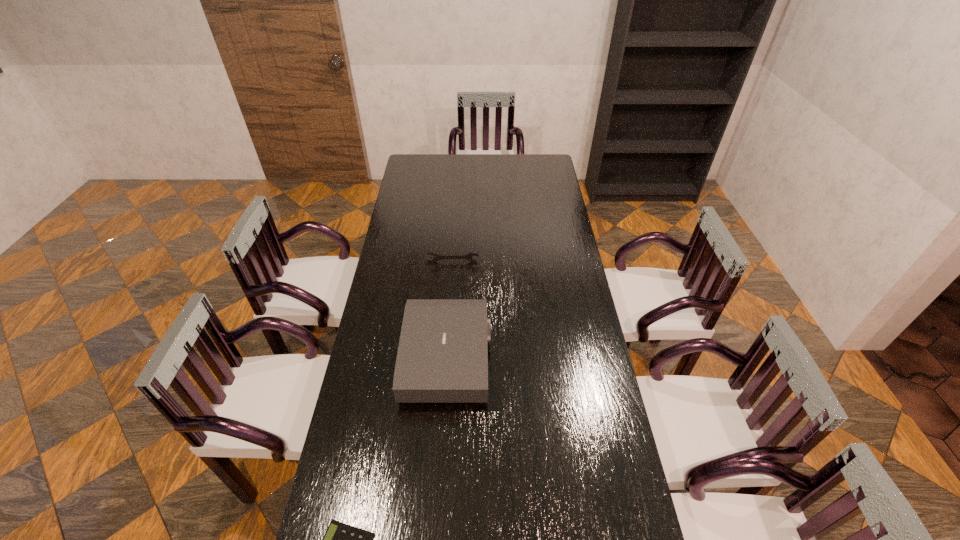
In the image, there is a desktop. Where is `vacant space at the far left corner`? This screenshot has width=960, height=540. vacant space at the far left corner is located at coordinates (413, 158).

Where is `object that is the closest to the second shortest object`? object that is the closest to the second shortest object is located at coordinates (442, 357).

Image resolution: width=960 pixels, height=540 pixels. What are the coordinates of `the second closest object to the projector` in the screenshot? It's located at (340, 539).